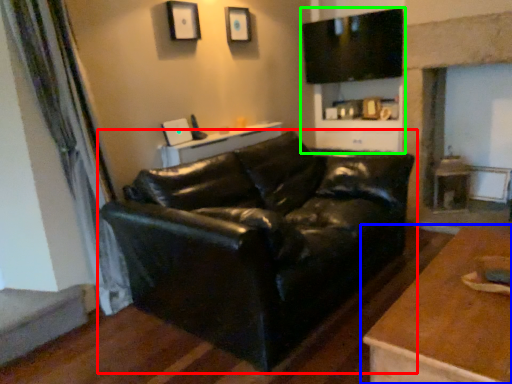
Question: Estimate the real-world distances between objects in this image. Which object is closer to studio couch (highlighted by a red box), table (highlighted by a blue box) or entertainment center (highlighted by a green box)?

Choices:
 (A) table
 (B) entertainment center

Answer: (A)